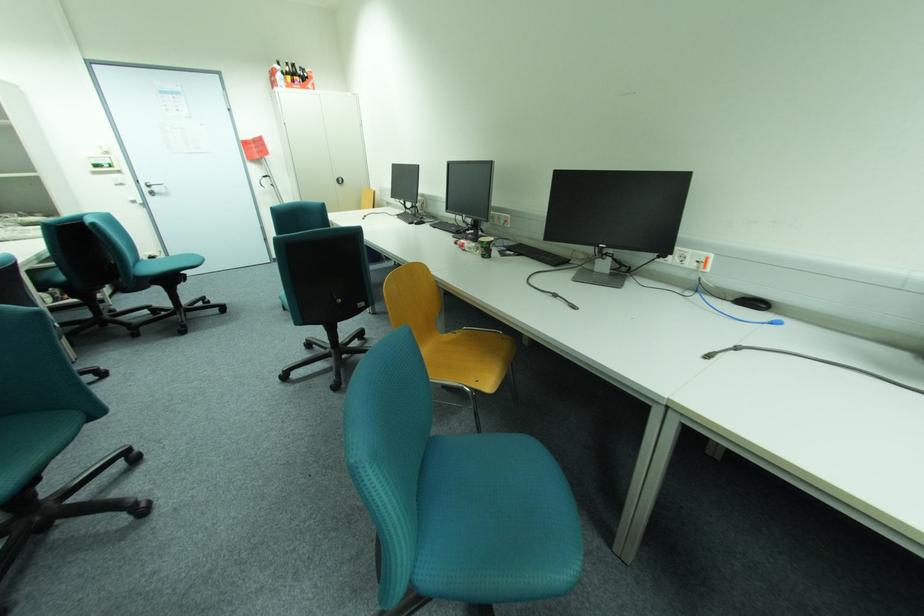
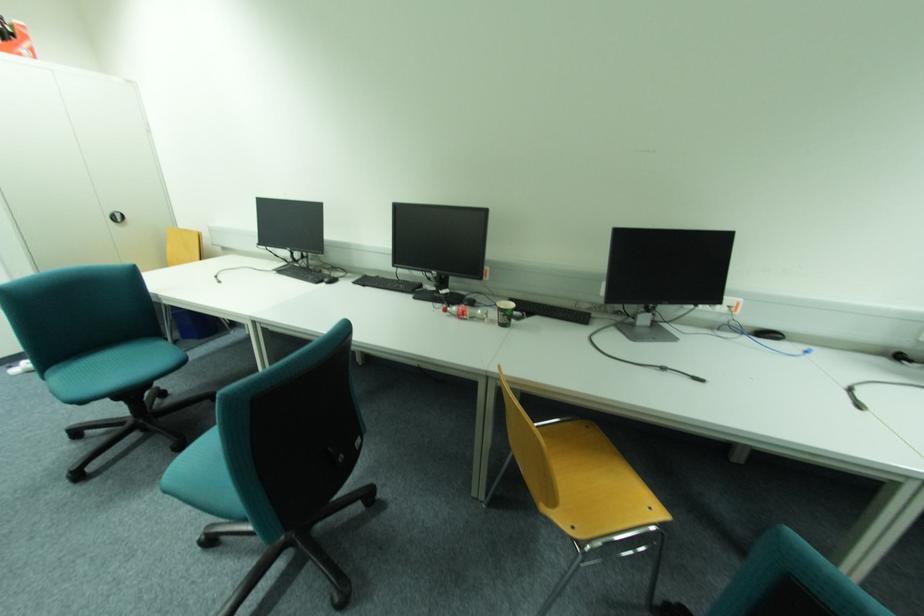
In the second image, find the point that corresponds to (x=346, y=182) in the first image.

(126, 219)